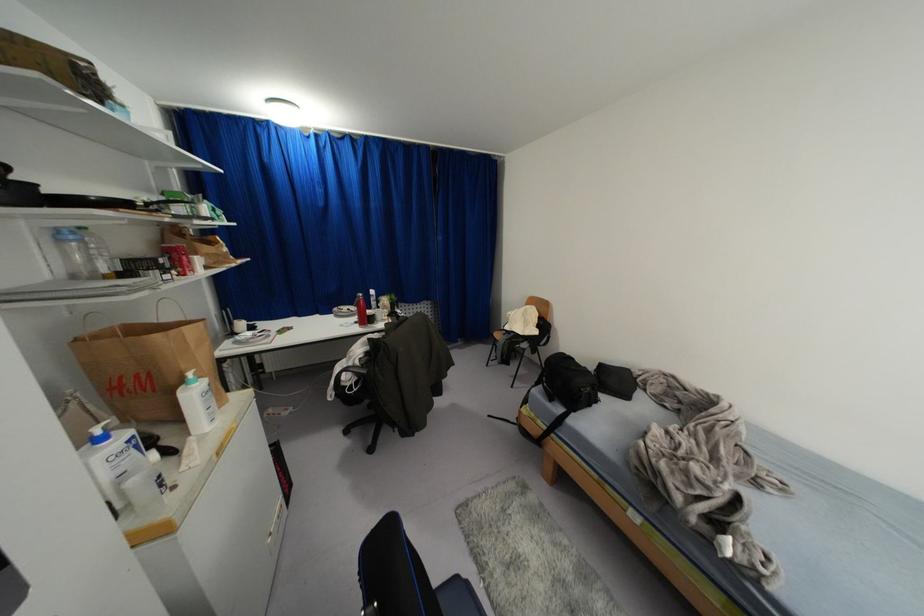
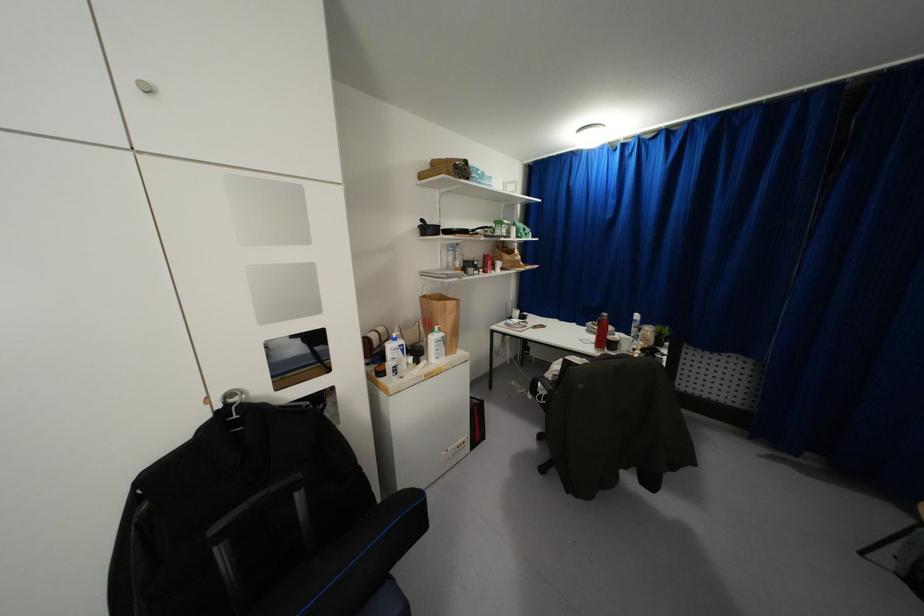
The point at (x=62, y=240) is marked in the first image. Where is the corresponding point in the second image?

(446, 249)